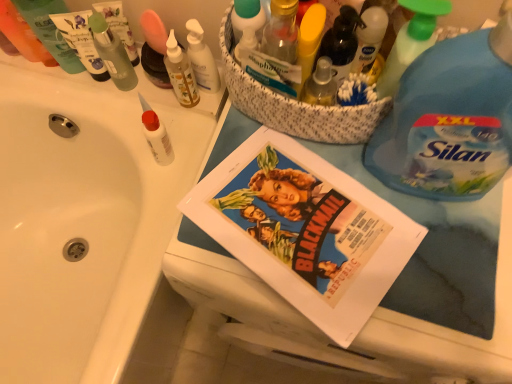
This screenshot has width=512, height=384. I want to click on vacant region to the left of green translucent bottle at upper left, which is the 4th toiletry in left-to-right order, so click(49, 86).